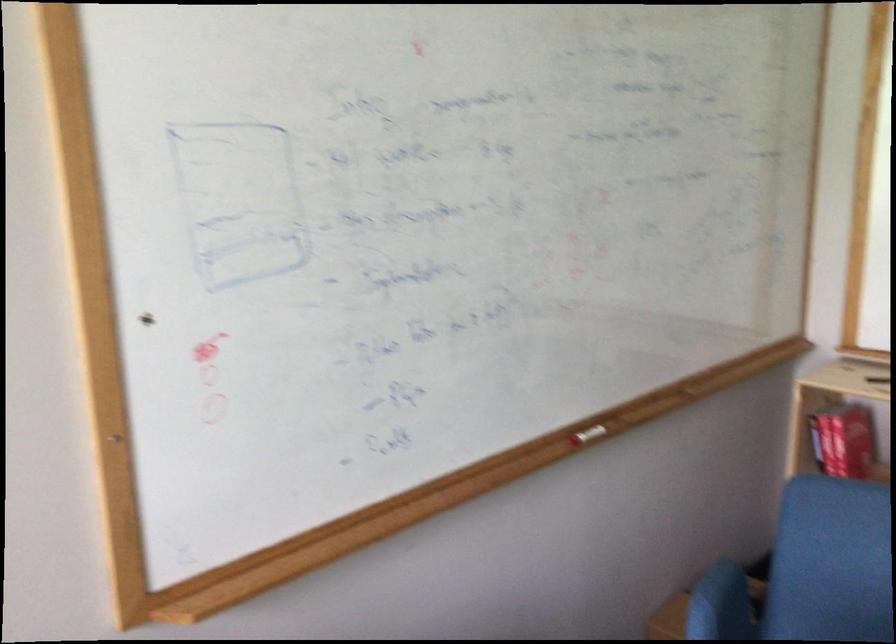
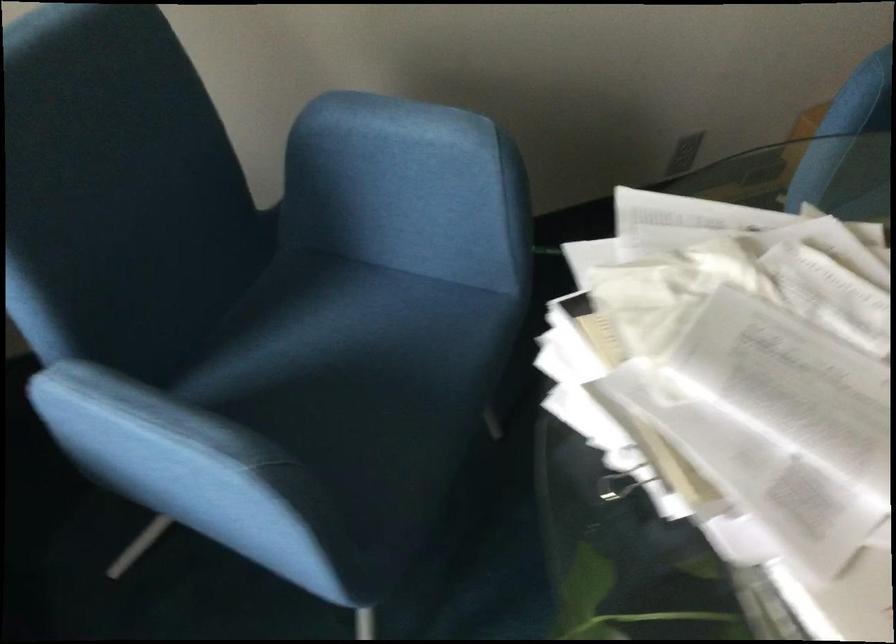
Question: Based on the continuous images, in which direction is the camera rotating? Reply with the corresponding letter.

Choices:
 (A) Left
 (B) Right
 (C) Up
 (D) Down

Answer: (D)